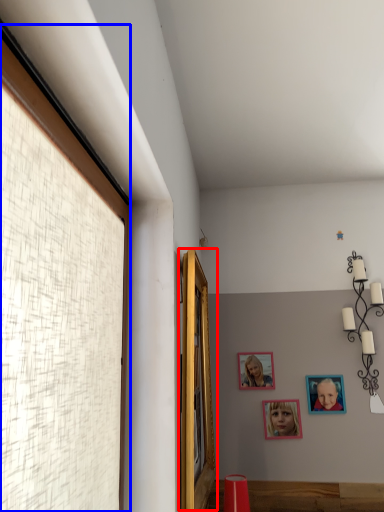
Question: Which object appears farthest to the camera in this image, window (highlighted by a red box) or window (highlighted by a blue box)?

Choices:
 (A) window
 (B) window

Answer: (A)